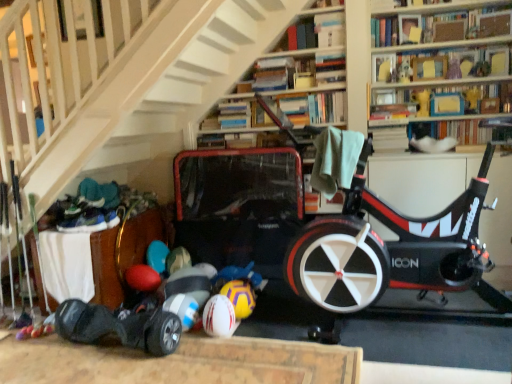
Where is `vacant space to the right of yellowtexturebeach ball at lower center`? The width and height of the screenshot is (512, 384). vacant space to the right of yellowtexturebeach ball at lower center is located at coordinates (265, 317).